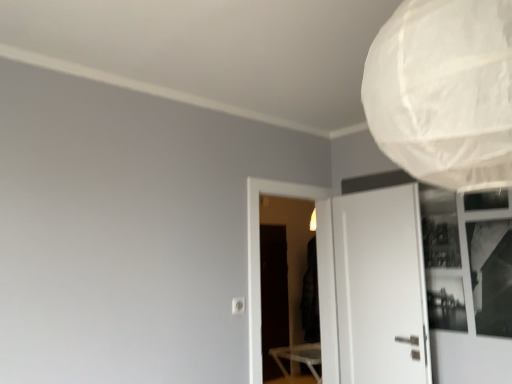
Question: Looking at their shapes, would you say white paper lampshade at upper right is wider or thinner than black matte screen door at center, the first screen door positioned from the back?

Choices:
 (A) thin
 (B) wide

Answer: (B)

Question: From a real-world perspective, is white paper lampshade at upper right positioned above or below black matte screen door at center, the 2th screen door when ordered from front to back?

Choices:
 (A) below
 (B) above

Answer: (B)

Question: Estimate the real-world distances between objects in this image. Which object is closer to the black matte screen door at center, the 2th screen door when ordered from front to back?

Choices:
 (A) transparent plastic screen door at center, which is counted as the second screen door, starting from the back
 (B) white paper lampshade at upper right
 (C) white matte door at right
 (D) black glass window at upper right

Answer: (A)

Question: Which object is positioned farthest from the black matte screen door at center, the first screen door positioned from the back?

Choices:
 (A) white matte door at right
 (B) white paper lampshade at upper right
 (C) transparent plastic screen door at center, acting as the 1th screen door starting from the front
 (D) black glass window at upper right

Answer: (B)